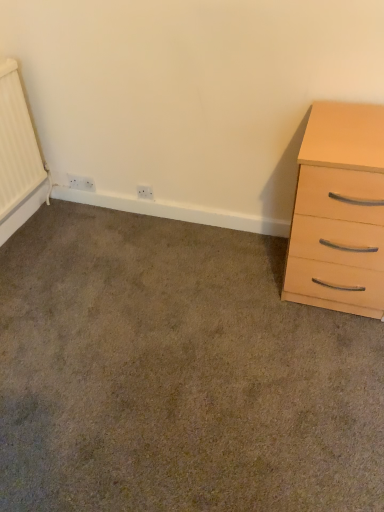
The image size is (384, 512). I want to click on free space that is to the left of light wood/veneer chest of drawers at right, so click(x=240, y=286).